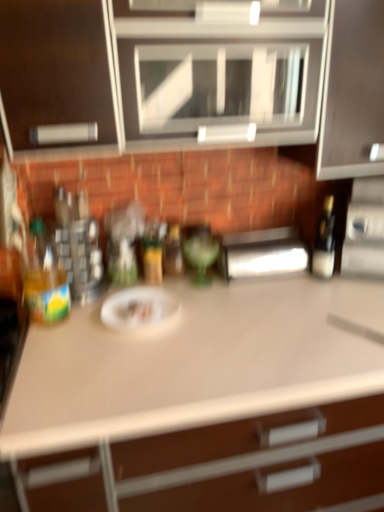
Where is `vacant area on top of satin silver paper towel dispenser at center, the 2th appliance positioned from the right (from a real-world perspective)`? The height and width of the screenshot is (512, 384). vacant area on top of satin silver paper towel dispenser at center, the 2th appliance positioned from the right (from a real-world perspective) is located at coordinates (263, 233).